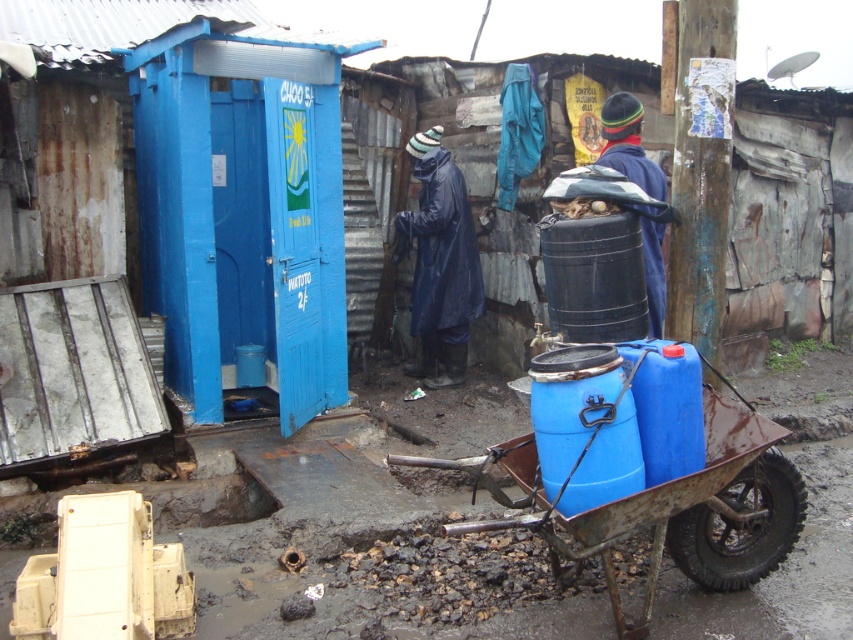
You are a delivery person who needs to carry a package from the blue plastic cart at lower center to the shiny blue raincoat at center. Considering their sizes, which object requires more space to maneuver around?

The blue plastic cart at lower center requires more space to maneuver around because its width is larger than the shiny blue raincoat at center.

You are a delivery person who needs to choose between the shiny blue raincoat at center and the blue fabric jacket at center to protect yourself from the rain. Based on their positions in the image, which one is more likely to be accessible to you?

The shiny blue raincoat at center is more likely to be accessible because it is positioned below the blue fabric jacket at center, meaning it is closer to the ground and easier to reach.

You are a delivery person who needs to choose between the shiny blue raincoat at center and the blue fabric jacket at center to protect yourself from the rain. Based on their positions in the image, which one is more likely to be accessible to you?

The shiny blue raincoat at center is more accessible because it is in front of the blue fabric jacket at center, making it easier to reach.